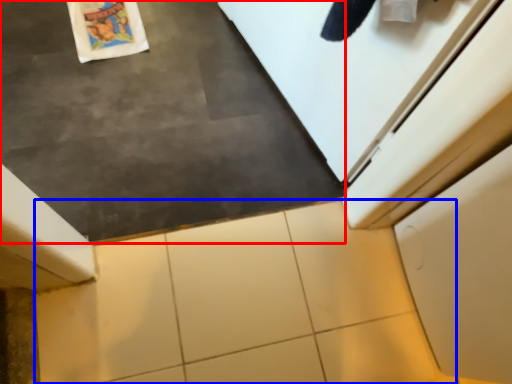
Question: Which object is closer to the camera taking this photo, slate (highlighted by a red box) or tile (highlighted by a blue box)?

Choices:
 (A) slate
 (B) tile

Answer: (A)